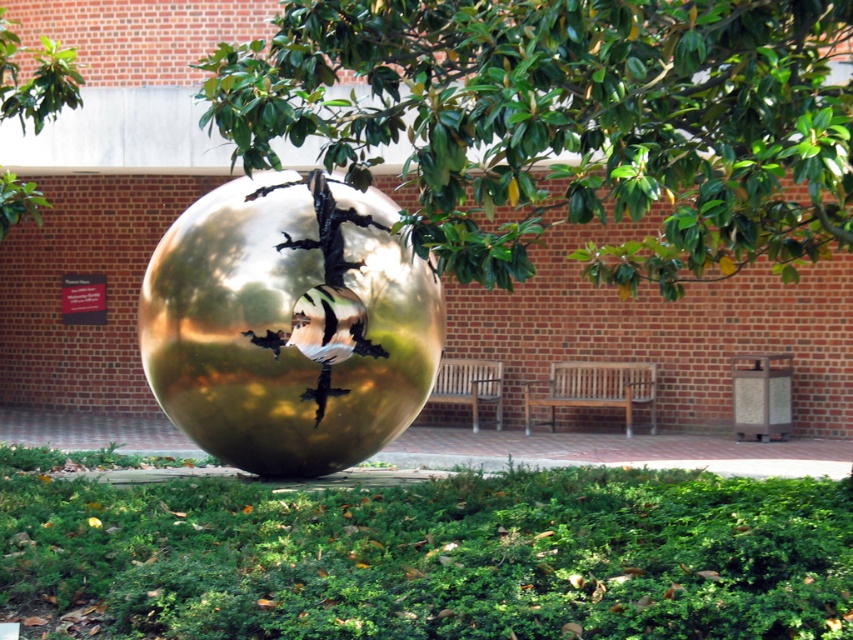
What are the coordinates of `green leafy tree at center` in the screenshot? It's located at (567, 124).

Can you confirm if green leafy tree at center is thinner than wooden bench at center?

Yes, green leafy tree at center is thinner than wooden bench at center.

Is point (221, 77) farther from camera compared to point (622, 388)?

No, (221, 77) is closer to viewer.

Find the location of a particular element. Image resolution: width=853 pixels, height=640 pixels. green leafy tree at center is located at coordinates (567, 124).

Between green leafy tree at center and wooden park bench at center, which one is positioned lower?

Positioned lower is wooden park bench at center.

Does green leafy tree at center have a lesser width compared to wooden park bench at center?

Incorrect, green leafy tree at center's width is not less than wooden park bench at center's.

Identify the location of green leafy tree at center. This screenshot has width=853, height=640. (567, 124).

Can you confirm if gold reflective sphere at center is positioned to the left of green leafy tree at upper center?

In fact, gold reflective sphere at center is to the right of green leafy tree at upper center.

What do you see at coordinates (289, 324) in the screenshot? I see `gold reflective sphere at center` at bounding box center [289, 324].

Find the location of a particular element. This screenshot has height=640, width=853. gold reflective sphere at center is located at coordinates (289, 324).